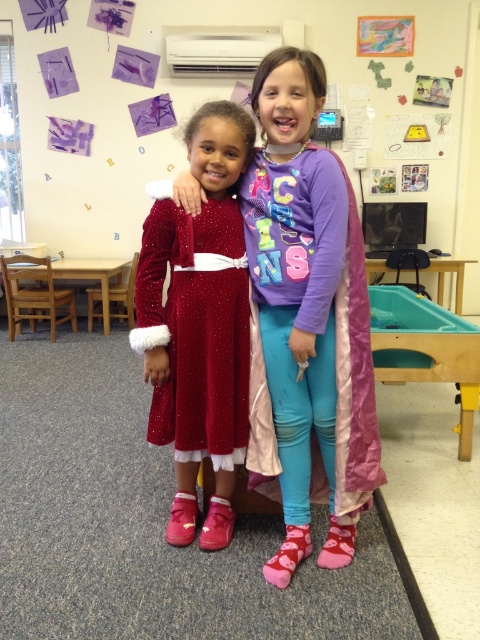
You are a photographer trying to capture the velvet shiny dress at center in a closeup shot. Based on its position, where should you aim your camera?

The velvet shiny dress at center is located at the coordinates point (195, 330), so you should aim your camera at that point to capture it in a closeup shot.

You are a costume designer preparing for a play. You need to arrange the velvet shiny dress at center and the pink satin cape at center on a mannequin. Considering their positions in the image, can you place them close enough so that they touch each other when displayed?

The velvet shiny dress at center is 7.91 inches from the pink satin cape at center. Since they are only 7.91 inches apart in the image, they can be placed close enough to touch each other when displayed.

You are a photographer setting up for a photo shoot in a classroom. You notice two items at the center of the scene. Which one is positioned lower between the velvet shiny dress at center and the pink satin cape at center?

The velvet shiny dress at center is positioned lower than the pink satin cape at center.